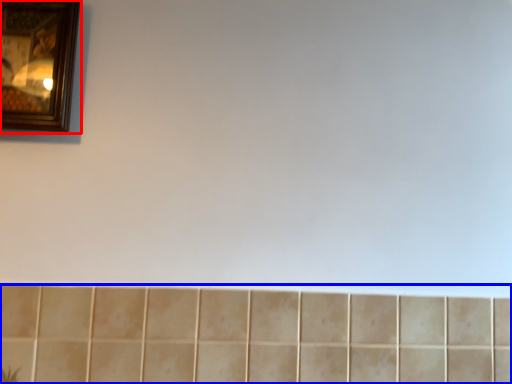
Question: Among these objects, which one is nearest to the camera, picture frame (highlighted by a red box) or ceramic tile (highlighted by a blue box)?

Choices:
 (A) picture frame
 (B) ceramic tile

Answer: (B)